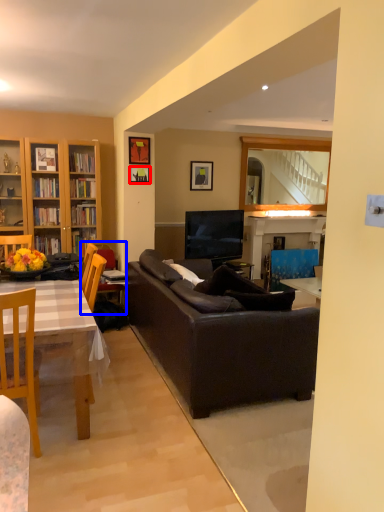
Question: Which point is closer to the camera, picture frame (highlighted by a red box) or armchair (highlighted by a blue box)?

Choices:
 (A) picture frame
 (B) armchair

Answer: (B)